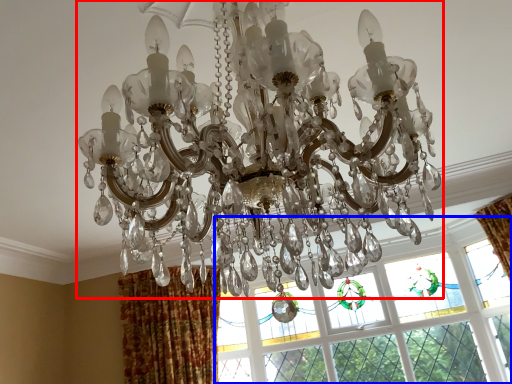
Question: Among these objects, which one is farthest to the camera, lamp (highlighted by a red box) or window (highlighted by a blue box)?

Choices:
 (A) lamp
 (B) window

Answer: (B)